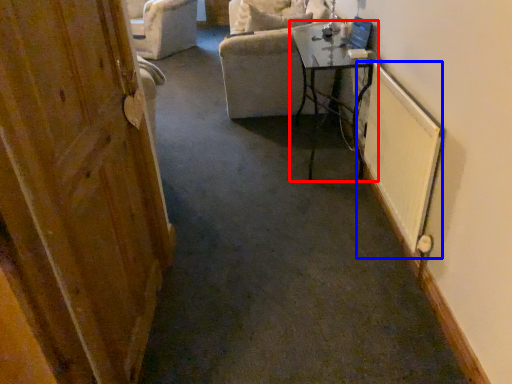
Question: Which object is further to the camera taking this photo, table (highlighted by a red box) or radiator (highlighted by a blue box)?

Choices:
 (A) table
 (B) radiator

Answer: (A)